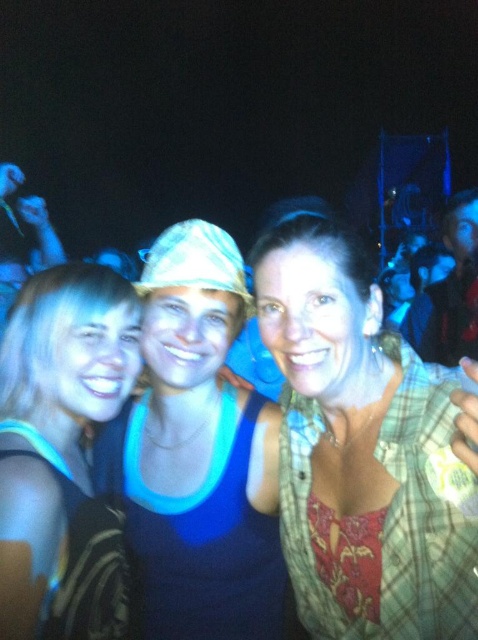
Question: Which point is farther to the camera?

Choices:
 (A) blonde hair at left
 (B) plaid fabric shirt at center

Answer: (A)

Question: Can you confirm if plaid fabric shirt at center is smaller than blonde hair at left?

Choices:
 (A) no
 (B) yes

Answer: (A)

Question: Which object is positioned closest to the plaid fabric shirt at center?

Choices:
 (A) blue fabric tank top at center
 (B) blonde hair at left

Answer: (A)

Question: Is blue fabric tank top at center wider than blonde hair at left?

Choices:
 (A) no
 (B) yes

Answer: (B)

Question: Which of these objects is positioned closest to the plaid fabric shirt at center?

Choices:
 (A) blue fabric tank top at center
 (B) blonde hair at left

Answer: (A)

Question: Does blue fabric tank top at center appear over blonde hair at left?

Choices:
 (A) no
 (B) yes

Answer: (A)